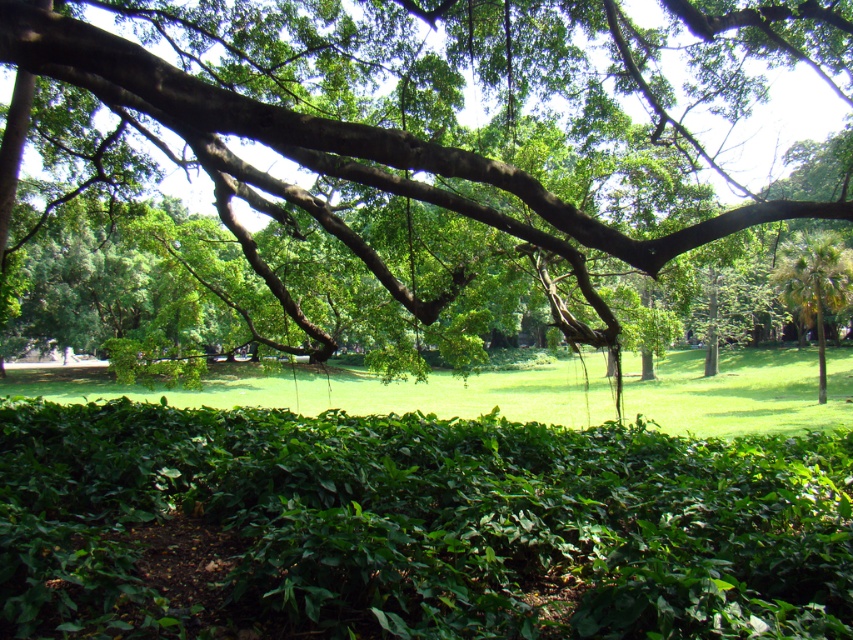
Question: Which is farther from the green grassy at center?

Choices:
 (A) green leafy bush at center
 (B) green leafy palm at right
 (C) green leafy tree at upper center

Answer: (C)

Question: Can you confirm if green leafy bush at center is positioned above green leafy tree at upper center?

Choices:
 (A) no
 (B) yes

Answer: (A)

Question: Is green grassy at center thinner than green leafy palm at right?

Choices:
 (A) yes
 (B) no

Answer: (B)

Question: Among these objects, which one is nearest to the camera?

Choices:
 (A) green leafy tree at upper center
 (B) green grassy at center

Answer: (A)

Question: Can you confirm if green grassy at center is wider than green leafy palm at right?

Choices:
 (A) yes
 (B) no

Answer: (A)

Question: Among these points, which one is nearest to the camera?

Choices:
 (A) (297, 593)
 (B) (38, 378)
 (C) (404, 77)

Answer: (A)